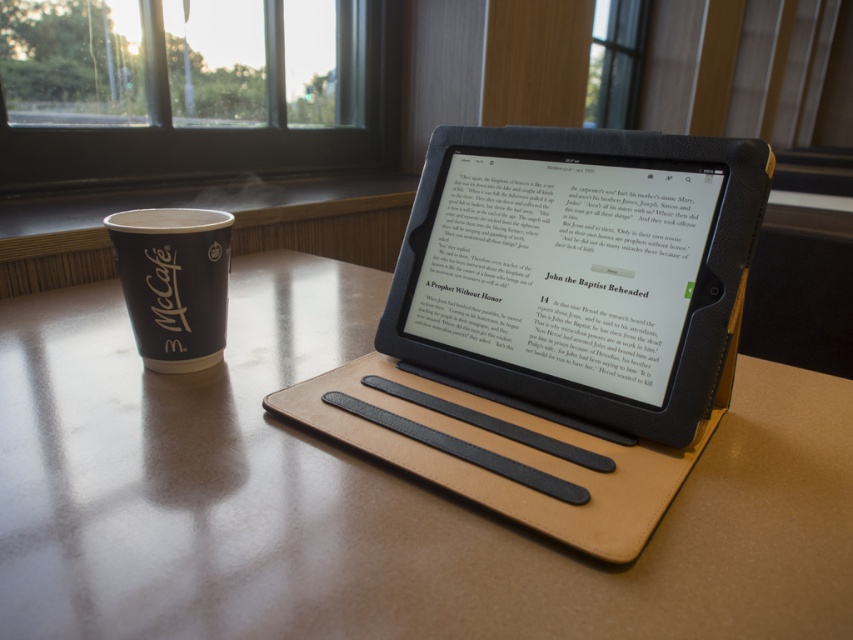
Question: Can you confirm if brown leather table at center is positioned to the left of black leather tablet at center?

Choices:
 (A) no
 (B) yes

Answer: (B)

Question: Is brown leather table at center smaller than black leather tablet at center?

Choices:
 (A) no
 (B) yes

Answer: (A)

Question: Which of the following is the farthest from the observer?

Choices:
 (A) brown leather table at center
 (B) black leather tablet at center

Answer: (B)

Question: Which of these objects is positioned closest to the brown leather table at center?

Choices:
 (A) black leather tablet at center
 (B) black paper cup at left

Answer: (A)

Question: Considering the relative positions of black leather tablet at center and black paper cup at left in the image provided, where is black leather tablet at center located with respect to black paper cup at left?

Choices:
 (A) above
 (B) below

Answer: (B)

Question: Which point is farther to the camera?

Choices:
 (A) black paper cup at left
 (B) black leather tablet at center
 (C) brown leather table at center

Answer: (A)